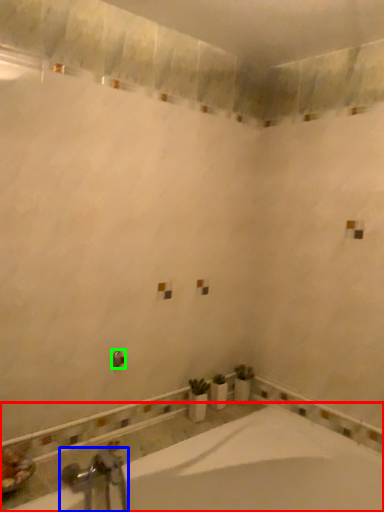
Question: Based on their relative distances, which object is nearer to bathtub (highlighted by a red box)? Choose from tap (highlighted by a blue box) and shower (highlighted by a green box).

Choices:
 (A) tap
 (B) shower

Answer: (A)